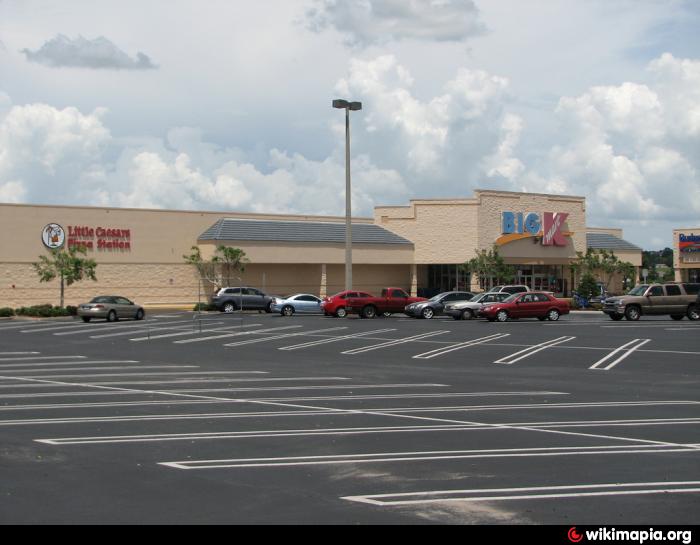
Find the location of a particular element. This screenshot has height=545, width=700. tan pillar is located at coordinates (680, 275), (638, 278), (323, 283), (414, 278), (220, 280).